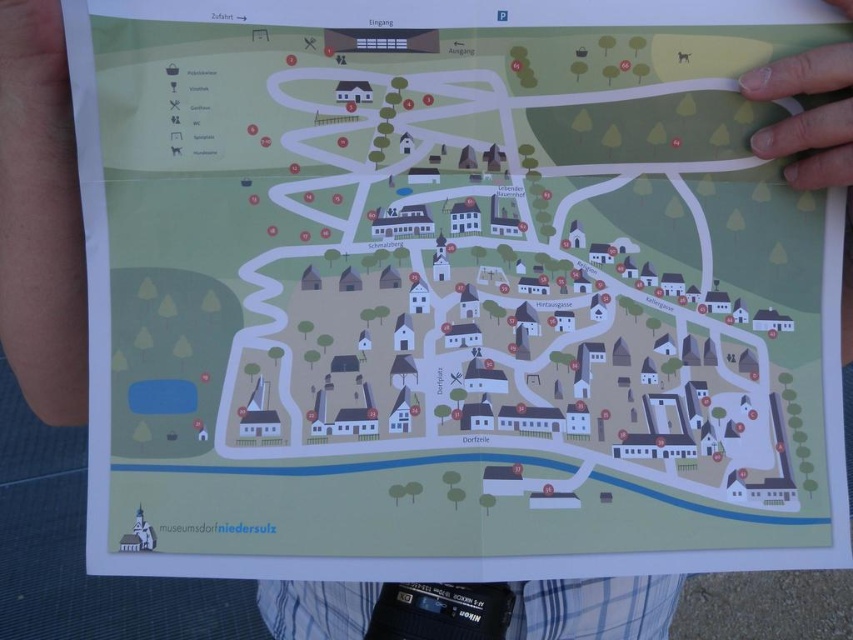
Question: Does skinsmoothhand at left have a greater width compared to white matte finger at upper right?

Choices:
 (A) no
 (B) yes

Answer: (B)

Question: Which object is closer to the camera taking this photo?

Choices:
 (A) white matte finger at upper right
 (B) skinsmoothhand at left

Answer: (A)

Question: Can you confirm if skinsmoothhand at left is smaller than white matte finger at upper right?

Choices:
 (A) yes
 (B) no

Answer: (B)

Question: Is skinsmoothhand at left in front of white matte finger at upper right?

Choices:
 (A) no
 (B) yes

Answer: (A)

Question: Which object appears closest to the camera in this image?

Choices:
 (A) white matte finger at upper right
 (B) skinsmoothhand at left

Answer: (A)